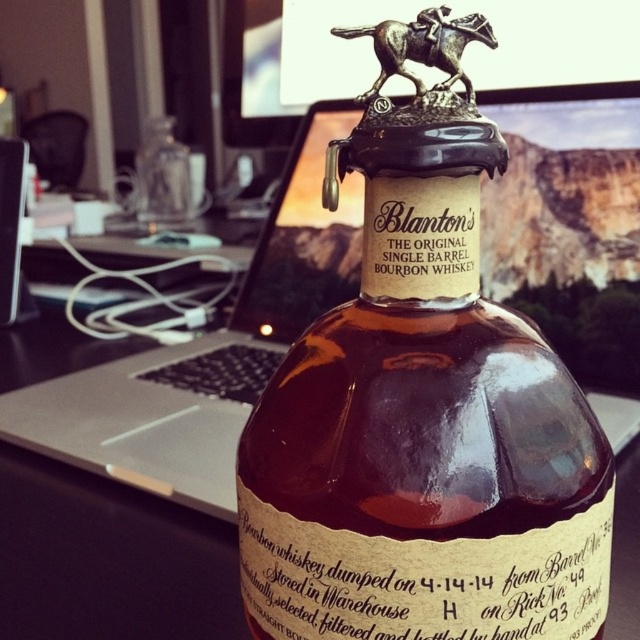
You are looking at the image of the whiskey bottle. Where is the point located at coordinates (422, 426) in relation to the brown glass bottle at center?

The point at coordinates (422, 426) corresponds to the brown glass bottle at center.